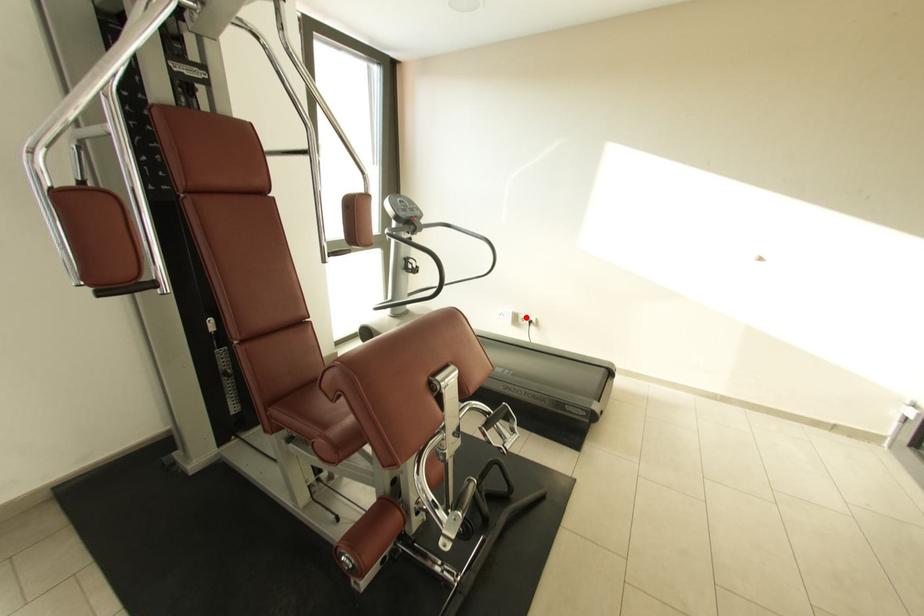
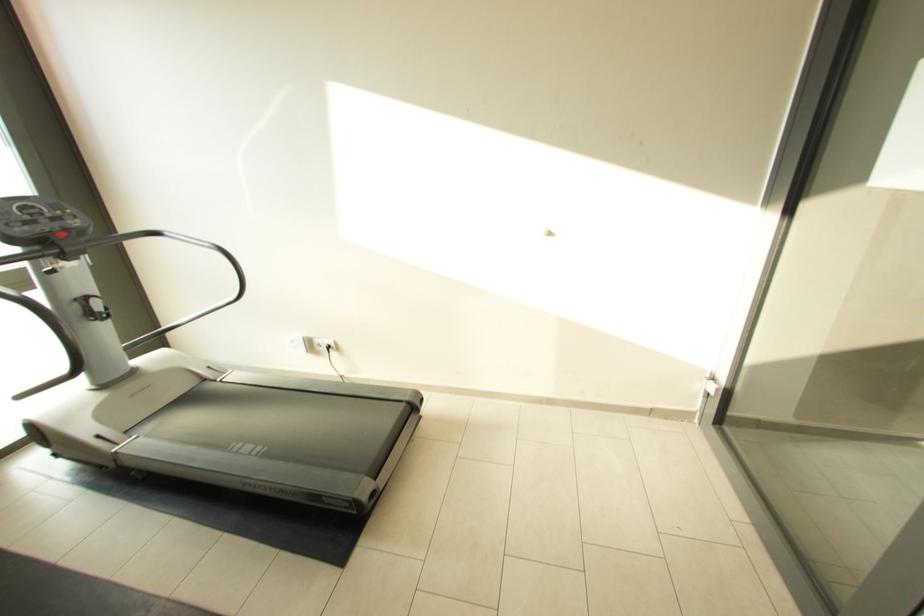
Question: A red point is marked in image1. In image2, is the corresponding 3D point closer to the camera or farther? Reply with the corresponding letter.

Choices:
 (A) The corresponding 3D point is closer.
 (B) The corresponding 3D point is farther.

Answer: (B)